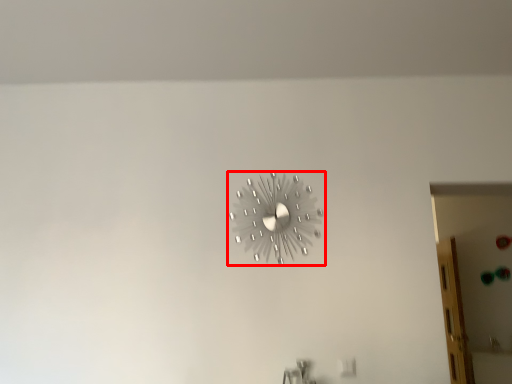
Question: From the image's perspective, what is the correct spatial positioning of wall clock (annotated by the red box) in reference to glass door?

Choices:
 (A) above
 (B) below

Answer: (A)